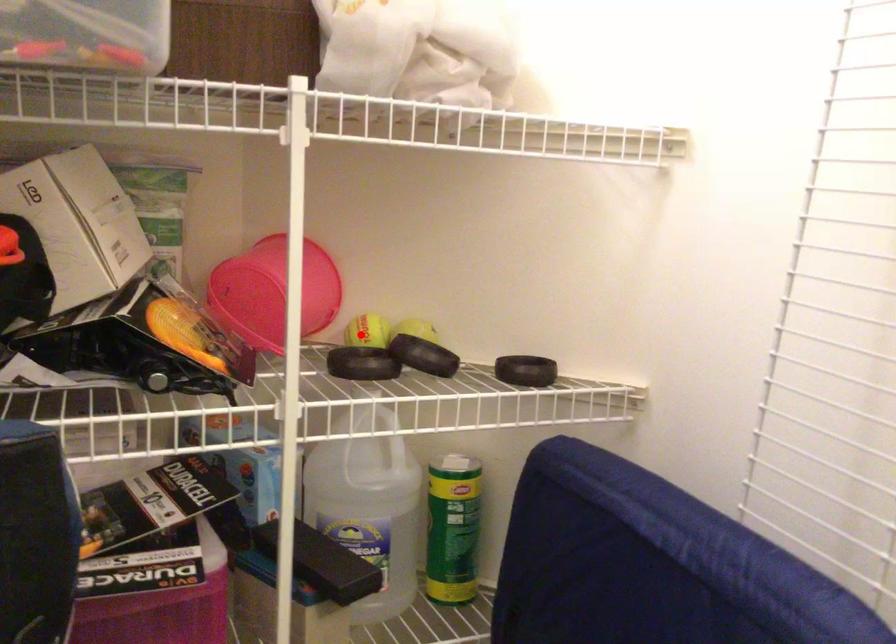
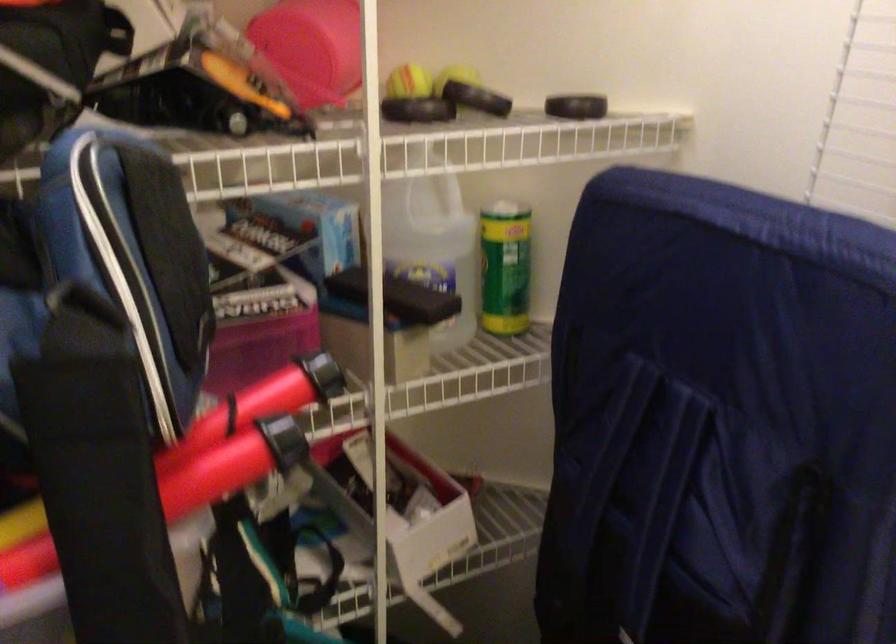
Find the pixel in the second image that matches the highlighted location in the first image.

(409, 82)